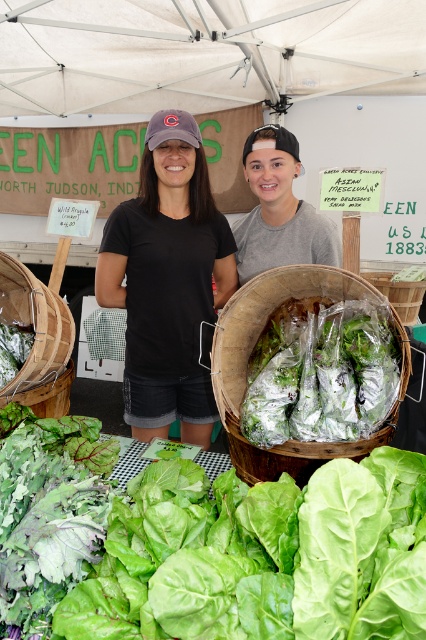
Between point (155, 234) and point (258, 474), which one is positioned behind?

Point (155, 234)

Which is above, black cotton t-shirt at center or natural wood basket at center?

black cotton t-shirt at center

Which is in front, point (172, 134) or point (271, 275)?

Point (271, 275) is more forward.

Locate an element on the screen. black cotton t-shirt at center is located at coordinates (167, 280).

Does green leafy lettuce at center have a greater width compared to black cotton t-shirt at center?

Incorrect, green leafy lettuce at center's width does not surpass black cotton t-shirt at center's.

Is green leafy lettuce at center to the right of black cotton t-shirt at center from the viewer's perspective?

Incorrect, green leafy lettuce at center is not on the right side of black cotton t-shirt at center.

Which is in front, point (371, 616) or point (187, 124)?

Point (371, 616)

Locate an element on the screen. This screenshot has width=426, height=640. green leafy lettuce at center is located at coordinates (259, 556).

Who is lower down, green leafy lettuce at center or natural wood basket at center?

green leafy lettuce at center is lower down.

Is green leafy lettuce at center wider than natural wood basket at center?

Correct, the width of green leafy lettuce at center exceeds that of natural wood basket at center.

Which is behind, point (380, 573) or point (233, 445)?

The point (233, 445) is more distant.

Find the location of `green leafy lettuce at center`. green leafy lettuce at center is located at coordinates tap(259, 556).